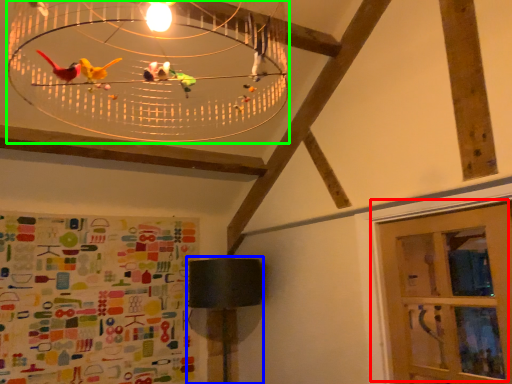
Question: Based on their relative distances, which object is farther from door (highlighted by a red box)? Choose from table lamp (highlighted by a blue box) and chandelier (highlighted by a green box).

Choices:
 (A) table lamp
 (B) chandelier

Answer: (B)